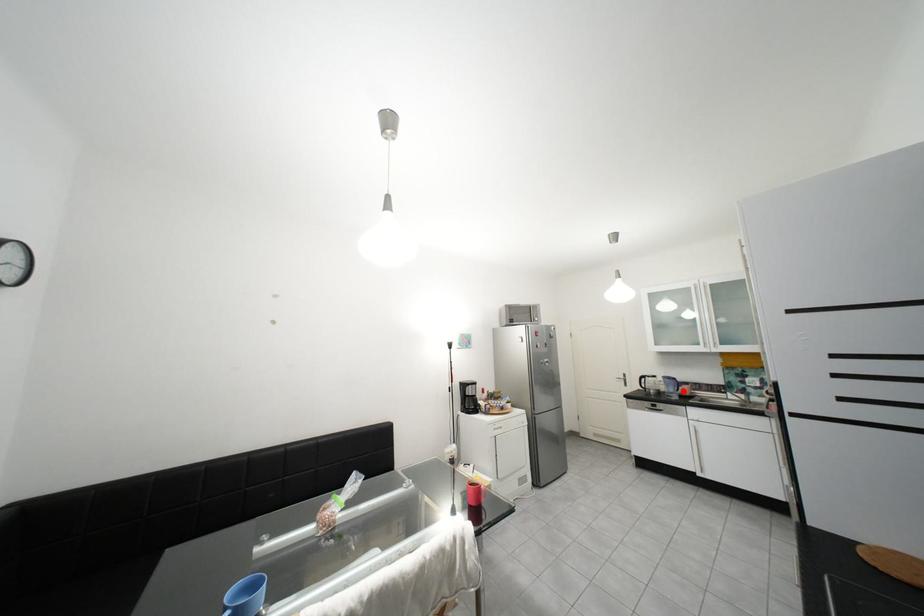
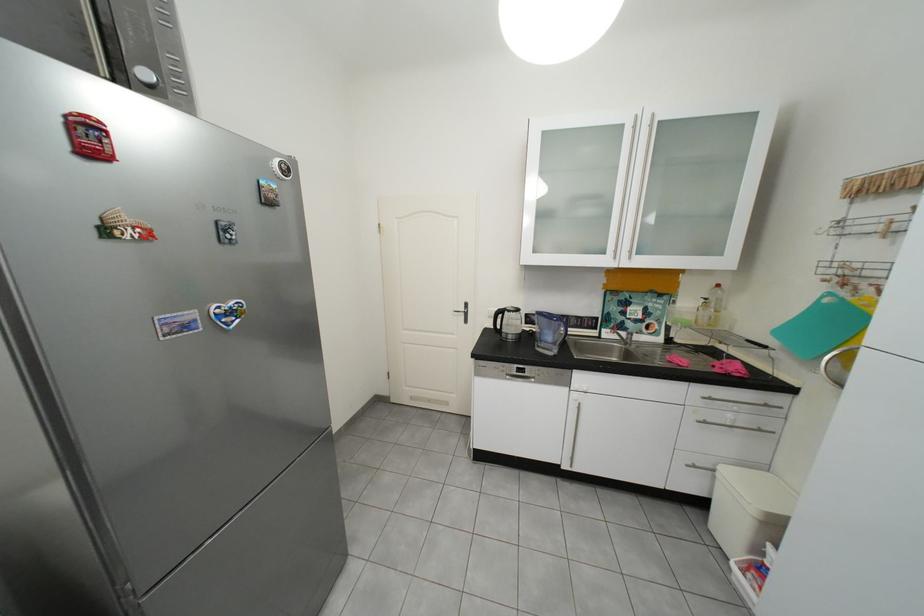
Question: I am providing you with two images of the same scene from different viewpoints. Image1 has a red point marked. In image2, the corresponding 3D location appears at what relative position? Reply with the corresponding letter.

Choices:
 (A) Closer
 (B) Farther

Answer: (A)